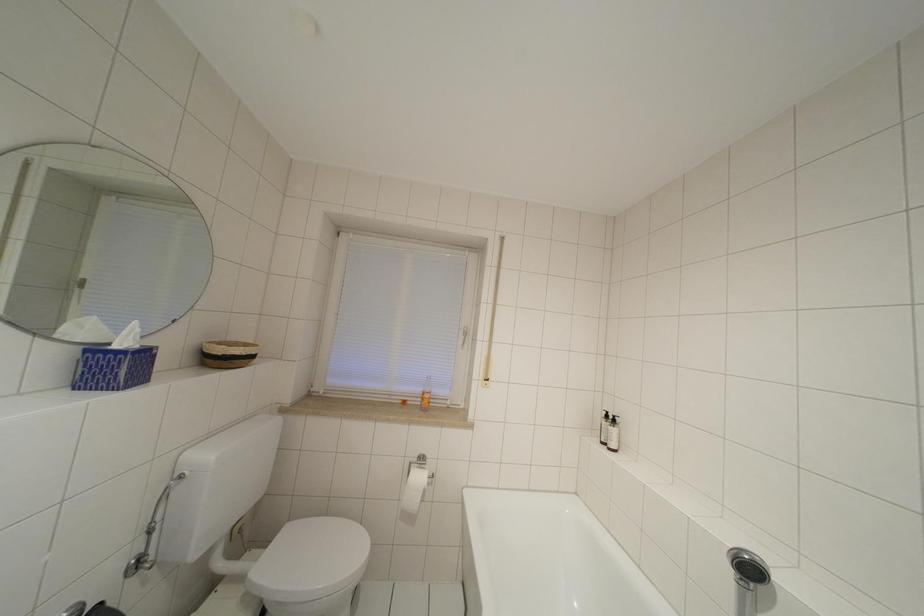
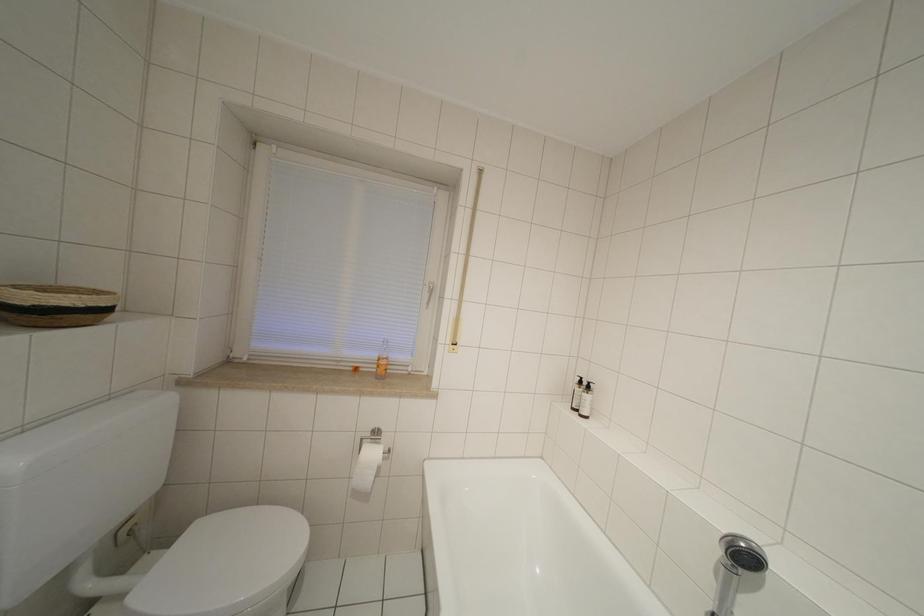
Question: In a continuous first-person perspective shot, in which direction is the camera moving?

Choices:
 (A) Left
 (B) Right
 (C) Forward
 (D) Backward

Answer: (C)